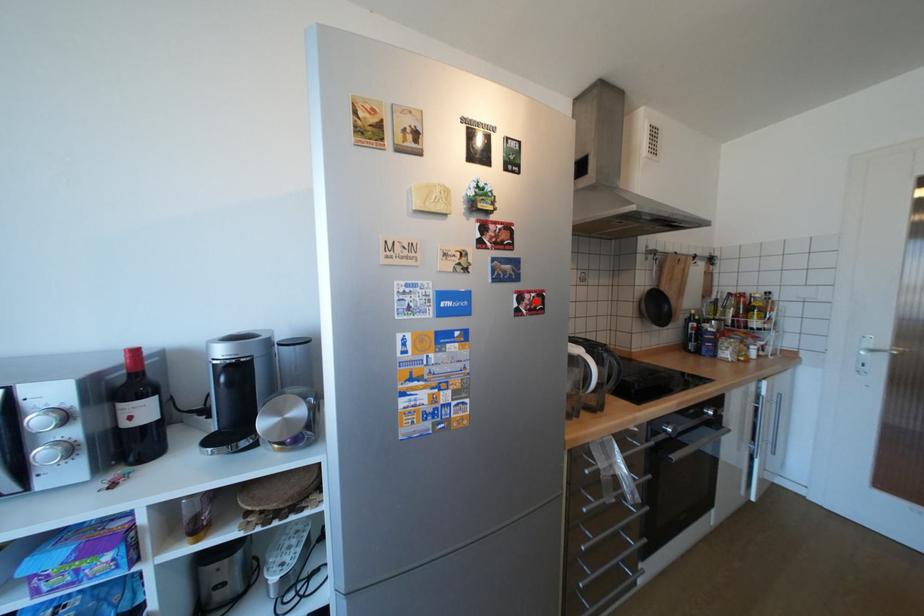
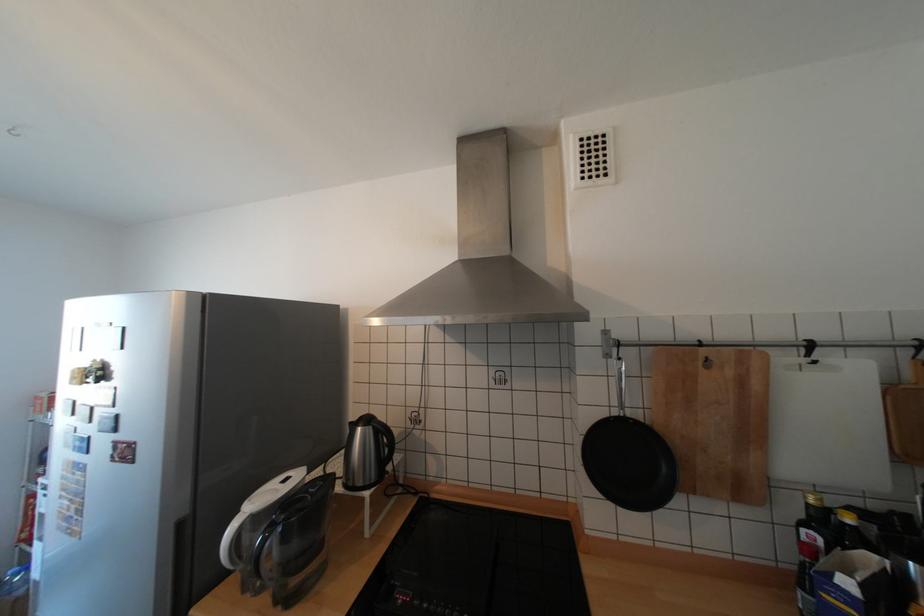
The point at the highlighted location is marked in the first image. Where is the corresponding point in the second image?

(128, 451)